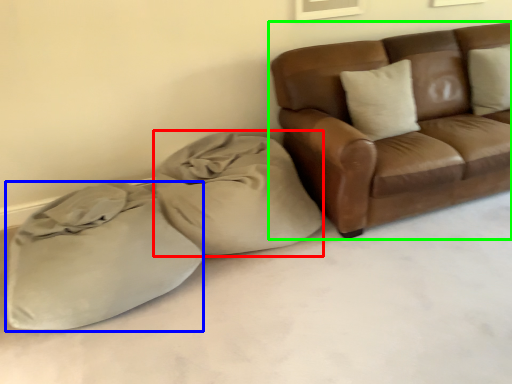
Question: Estimate the real-world distances between objects in this image. Which object is closer to bean bag chair (highlighted by a red box), sack (highlighted by a blue box) or studio couch (highlighted by a green box)?

Choices:
 (A) sack
 (B) studio couch

Answer: (A)